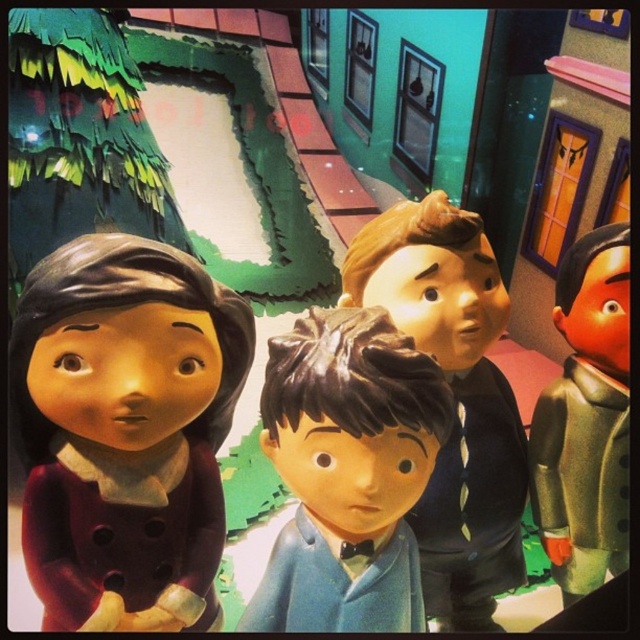
Can you confirm if matte brown doll at left is taller than matte brown hair at center?

No.

Can you confirm if matte brown doll at left is bigger than matte brown hair at center?

Incorrect, matte brown doll at left is not larger than matte brown hair at center.

Is point (188, 544) less distant than point (456, 554)?

That is True.

The width and height of the screenshot is (640, 640). Identify the location of matte brown doll at left. click(124, 422).

Is matte brown hair at center positioned in front of green matte suit at right?

Yes, it is.

Who is shorter, matte brown hair at center or green matte suit at right?

green matte suit at right

You are a GUI agent. You are given a task and a screenshot of the screen. Output one action in this format:
    pyautogui.click(x=<x>, y=<y>)
    Task: Click on the matte brown hair at center
    
    Given the screenshot: What is the action you would take?
    pyautogui.click(x=454, y=400)

Locate an element on the screen. This screenshot has width=640, height=640. matte brown hair at center is located at coordinates (454, 400).

Is satin blue suit at center thinner than green matte suit at right?

Incorrect, satin blue suit at center's width is not less than green matte suit at right's.

Is satin blue suit at center behind green matte suit at right?

That is False.

This screenshot has width=640, height=640. In order to click on satin blue suit at center in this screenshot , I will do `click(348, 472)`.

The image size is (640, 640). In order to click on satin blue suit at center in this screenshot , I will do `click(348, 472)`.